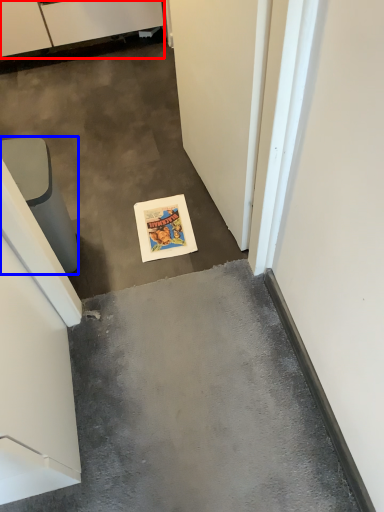
Question: Which of the following is the farthest to the observer, cabinetry (highlighted by a red box) or furniture (highlighted by a blue box)?

Choices:
 (A) cabinetry
 (B) furniture

Answer: (A)